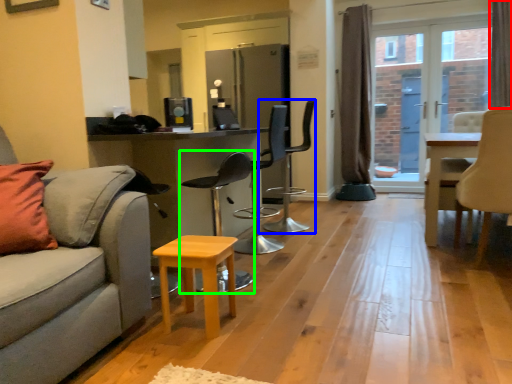
Question: Which object is the closest to the curtain (highlighted by a red box)? Choose among these: chair (highlighted by a blue box) or chair (highlighted by a green box).

Choices:
 (A) chair
 (B) chair

Answer: (A)